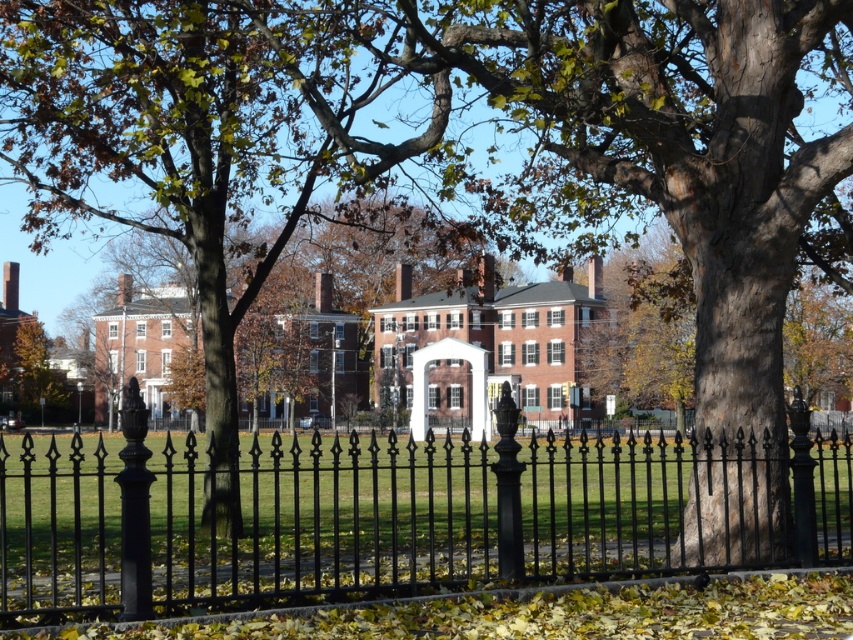
You are a painter planning to capture the scene in front of you. You notice the black wrought iron fence at center and the brown wood tree at center. Which object should you focus on if you want to highlight something that is shorter in the composition?

The black wrought iron fence at center has a lesser height compared to the brown wood tree at center, so you should focus on the black wrought iron fence at center to highlight a shorter object in the composition.